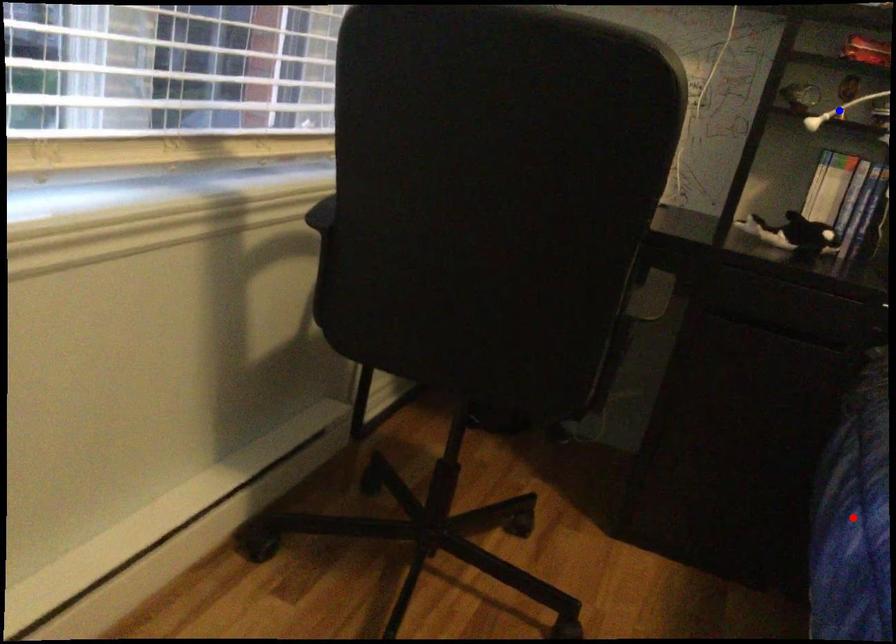
Question: In the image, two points are highlighted. Which point is nearer to the camera? Reply with the corresponding letter.

Choices:
 (A) blue point
 (B) red point

Answer: (B)